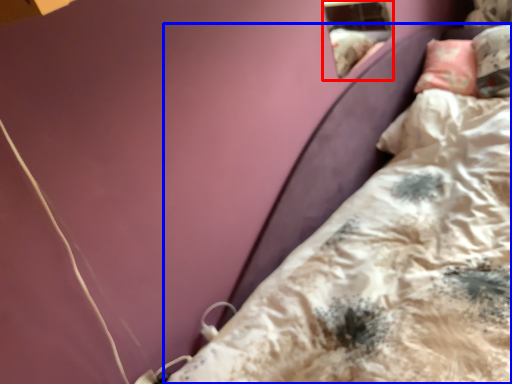
Question: Which point is further to the camera, window (highlighted by a red box) or bed (highlighted by a blue box)?

Choices:
 (A) window
 (B) bed

Answer: (A)